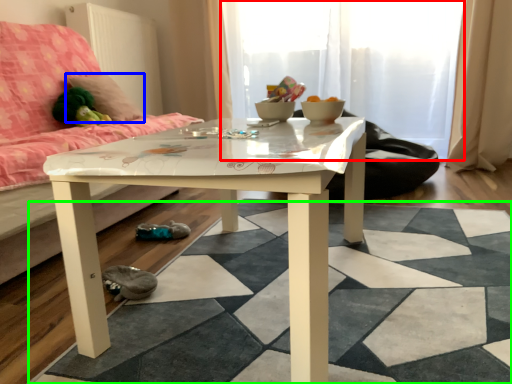
Question: Considering the real-world distances, which object is farthest from glass door (highlighted by a red box)? pillow (highlighted by a blue box) or square (highlighted by a green box)?

Choices:
 (A) pillow
 (B) square

Answer: (B)